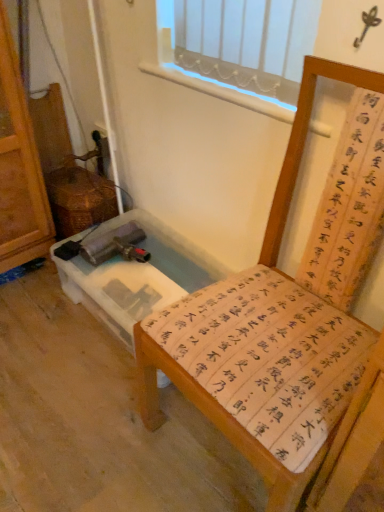
At what (x,y) coordinates should I click in order to perform the action: click on free spot above clear plastic vanity at lower left (from a real-world perspective). Please return your answer as a coordinate pair (x, y). The height and width of the screenshot is (512, 384). Looking at the image, I should click on (152, 270).